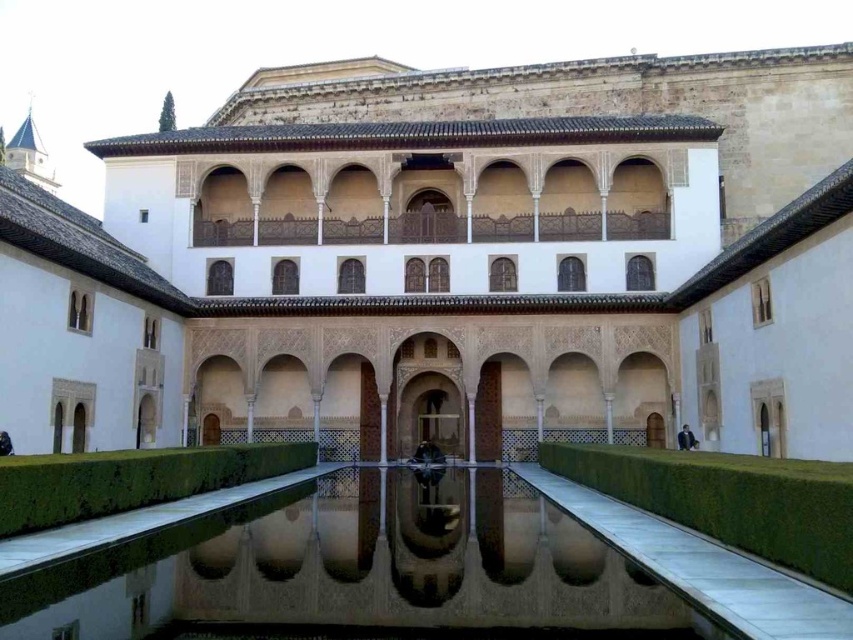
Consider the image. You are standing in the courtyard and want to take a photo of the clear glass water at center. If your camera can focus on objects up to 70 feet away, will you be able to take a clear photo from your current position?

The clear glass water at center and camera are 68.34 feet apart from each other. Since the camera can focus up to 70 feet, you can take a clear photo from your current position.

You are standing in the courtyard and want to take a photo of the point at coordinates (378,492). If your camera has a focal length of 50mm, what is the approximate distance in meters between you and the point?

The distance of point (378,492) from viewer is 52.06 meters, so the approximate distance between you and the point is 52.06 meters.